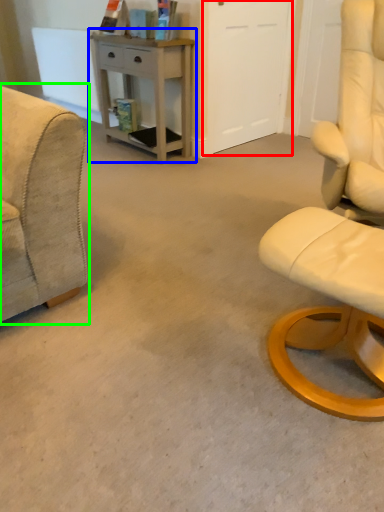
Question: Which object is positioned farthest from glass door (highlighted by a red box)? Select from desk (highlighted by a blue box) and chair (highlighted by a green box).

Choices:
 (A) desk
 (B) chair

Answer: (B)